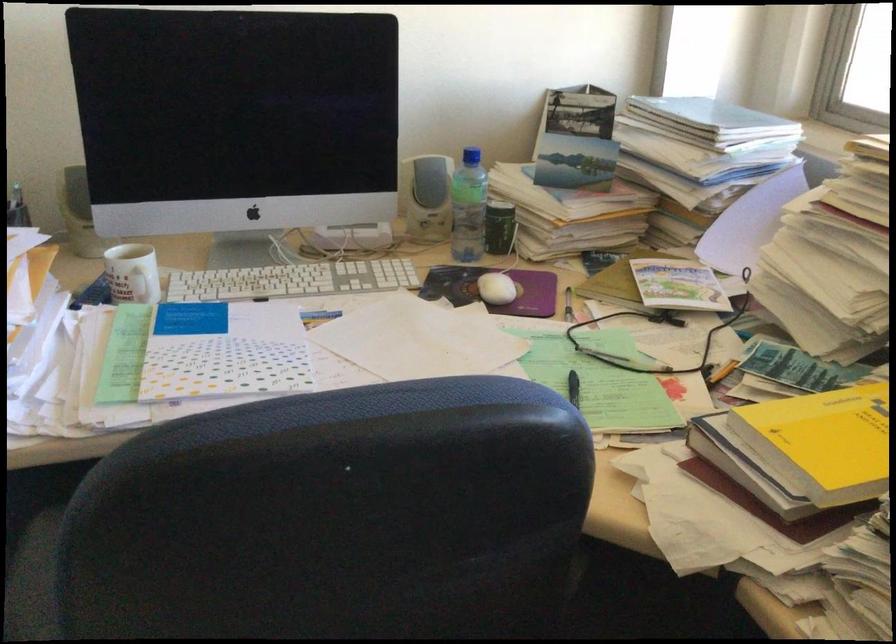
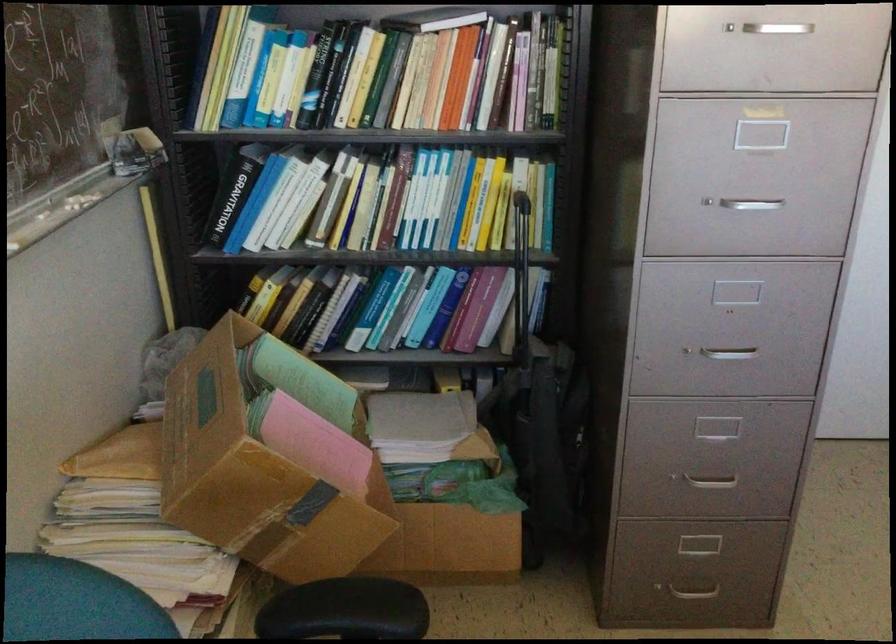
Based on the continuous images, in which direction is the camera rotating?

The camera rotated toward left-down.